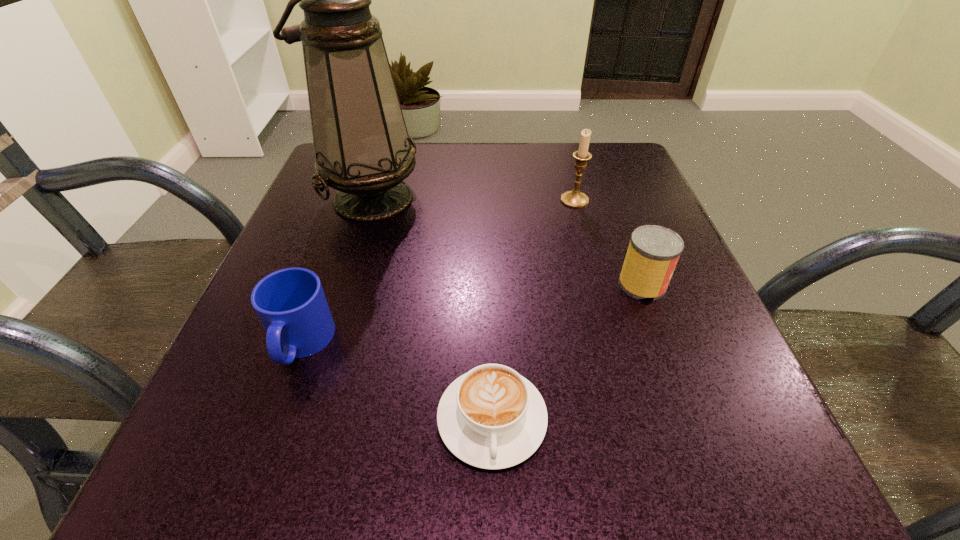
Where is `the tallest object`? The width and height of the screenshot is (960, 540). the tallest object is located at coordinates (362, 148).

This screenshot has width=960, height=540. I want to click on the fourth object from left to right, so click(575, 199).

I want to click on candle holder, so click(575, 199).

At what (x,y) coordinates should I click in order to perform the action: click on the third nearest object. Please return your answer as a coordinate pair (x, y). Looking at the image, I should click on (653, 252).

You are a GUI agent. You are given a task and a screenshot of the screen. Output one action in this format:
    pyautogui.click(x=<x>, y=<y>)
    Task: Click on the rightmost object
    
    Given the screenshot: What is the action you would take?
    pyautogui.click(x=653, y=252)

Locate an element on the screen. mug is located at coordinates (290, 303).

This screenshot has height=540, width=960. I want to click on the shortest object, so click(491, 417).

The width and height of the screenshot is (960, 540). In order to click on the third object from right to left in this screenshot , I will do `click(491, 417)`.

Locate an element on the screen. This screenshot has height=540, width=960. vacant space located on the front of the tallest object is located at coordinates (336, 311).

At what (x,y) coordinates should I click in order to perform the action: click on free space located on the left of the second object from right to left. Please return your answer as a coordinate pair (x, y). Looking at the image, I should click on (518, 200).